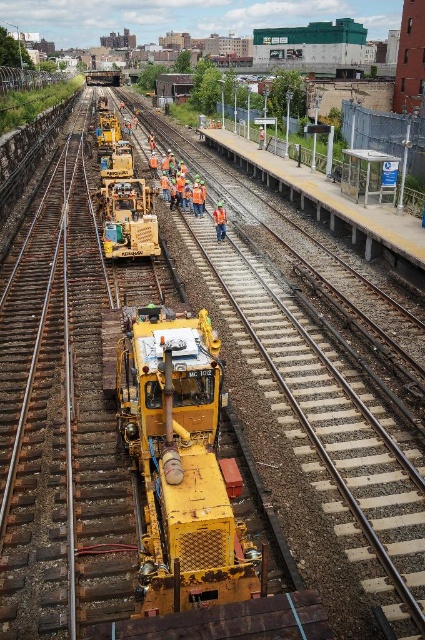
You are a safety inspector at the railway construction site. You need to ensure that the orange reflective safety vest at center is visible from a distance. Considering the matte yellow construction vehicle at center, which object is bigger and might block the visibility of the safety vest?

The matte yellow construction vehicle at center is larger in size than the orange reflective safety vest at center, so it might block the visibility of the safety vest.

You are a construction worker standing at the railway construction site. You need to determine which of the two points, point (146,400) or point (223,228), is nearer to you. Which point is closer?

Point (146,400) is closer to the camera than point (223,228), so the point closer to you is point (146,400).